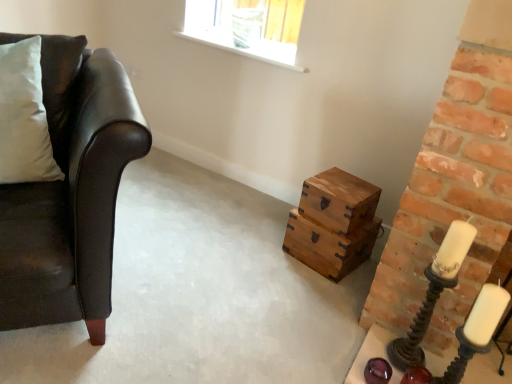
Question: From the image's perspective, does white wax candle at right appear lower than white soft pillow at left?

Choices:
 (A) yes
 (B) no

Answer: (A)

Question: Can you confirm if white wax candle at right is wider than white soft pillow at left?

Choices:
 (A) yes
 (B) no

Answer: (B)

Question: Considering the relative sizes of white wax candle at right and white soft pillow at left in the image provided, is white wax candle at right thinner than white soft pillow at left?

Choices:
 (A) yes
 (B) no

Answer: (A)

Question: Is white wax candle at right next to white soft pillow at left and touching it?

Choices:
 (A) no
 (B) yes

Answer: (A)

Question: Is white wax candle at right not inside white soft pillow at left?

Choices:
 (A) yes
 (B) no

Answer: (A)

Question: Is white wax candle at right positioned with its back to white soft pillow at left?

Choices:
 (A) yes
 (B) no

Answer: (B)

Question: Is matte black candle holder at right, the 1th candle holder in the right-to-left sequence, positioned in front of matte black leather couch at left?

Choices:
 (A) no
 (B) yes

Answer: (A)

Question: Is matte black candle holder at right, the second candle holder from the left, shorter than matte black leather couch at left?

Choices:
 (A) no
 (B) yes

Answer: (B)

Question: Does matte black candle holder at right, the second candle holder from the left, have a smaller size compared to matte black leather couch at left?

Choices:
 (A) no
 (B) yes

Answer: (B)

Question: Is matte black candle holder at right, the 1th candle holder in the right-to-left sequence, outside of matte black leather couch at left?

Choices:
 (A) yes
 (B) no

Answer: (A)

Question: Can you confirm if matte black candle holder at right, the 1th candle holder in the right-to-left sequence, is taller than matte black leather couch at left?

Choices:
 (A) yes
 (B) no

Answer: (B)

Question: Could you tell me if matte black candle holder at right, the second candle holder from the left, is turned towards matte black leather couch at left?

Choices:
 (A) yes
 (B) no

Answer: (B)

Question: Is wooden box at center facing away from metallic spiral candle holder at right, which is the 1th candle holder in left-to-right order?

Choices:
 (A) yes
 (B) no

Answer: (B)